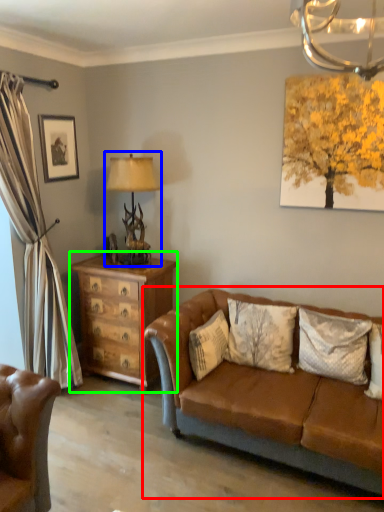
Question: Which object is positioned closest to studio couch (highlighted by a red box)? Select from table lamp (highlighted by a blue box) and chest of drawers (highlighted by a green box).

Choices:
 (A) table lamp
 (B) chest of drawers

Answer: (B)